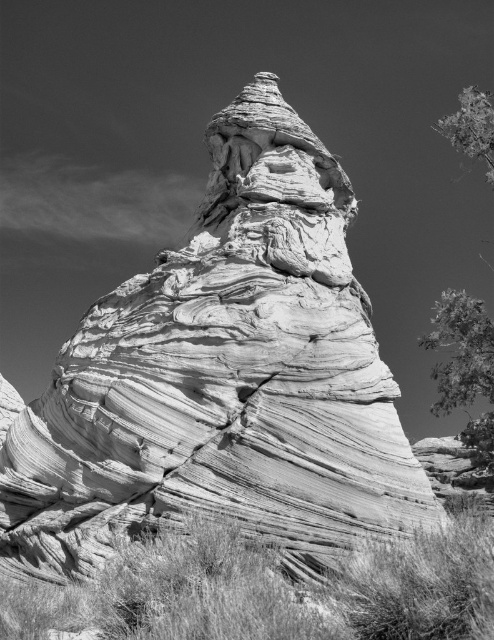
Does green leafy tree at upper right appear on the right side of smooth green leaves at upper right?

In fact, green leafy tree at upper right is to the left of smooth green leaves at upper right.

Does green leafy tree at upper right appear over smooth green leaves at upper right?

Incorrect, green leafy tree at upper right is not positioned above smooth green leaves at upper right.

This screenshot has height=640, width=494. What do you see at coordinates (464, 378) in the screenshot? I see `green leafy tree at upper right` at bounding box center [464, 378].

You are a GUI agent. You are given a task and a screenshot of the screen. Output one action in this format:
    pyautogui.click(x=<x>, y=<y>)
    Task: Click on the green leafy tree at upper right
    This screenshot has height=640, width=494.
    Given the screenshot: What is the action you would take?
    pyautogui.click(x=464, y=378)